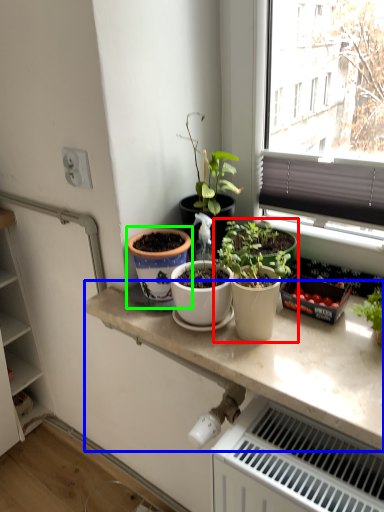
Question: Considering the real-world distances, which object is closest to houseplant (highlighted by a red box)? countertop (highlighted by a blue box) or flowerpot (highlighted by a green box).

Choices:
 (A) countertop
 (B) flowerpot

Answer: (A)